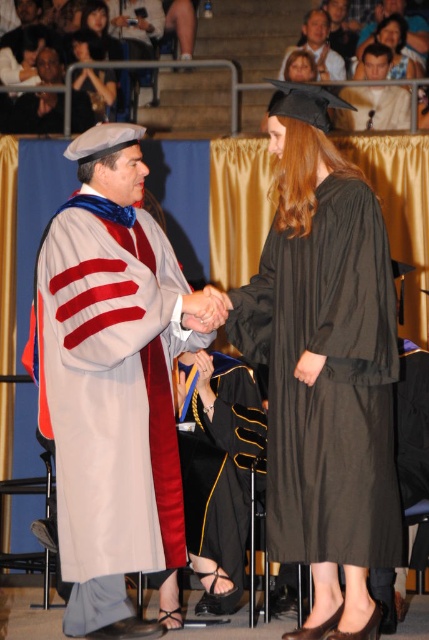
You are attending a graduation ceremony and see two graduates wearing the light gray wool graduation gown at center and the matte black gown at center. Which one is closer to you?

The light gray wool graduation gown at center is closer to you because it is in front of the matte black gown at center.

You are attending a graduation ceremony and notice two graduates wearing gowns. One is wearing a black matte gown at center and the other a matte black graduation gown at upper center. Which graduate is standing closer to the front of the stage?

The black matte gown at center is located below the matte black graduation gown at upper center, meaning the black matte gown at center is closer to the front of the stage.